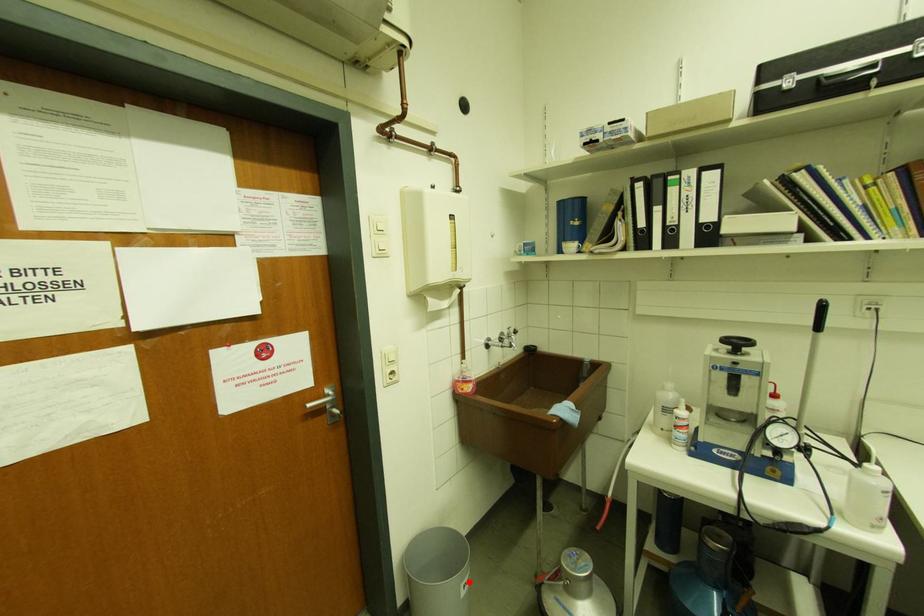
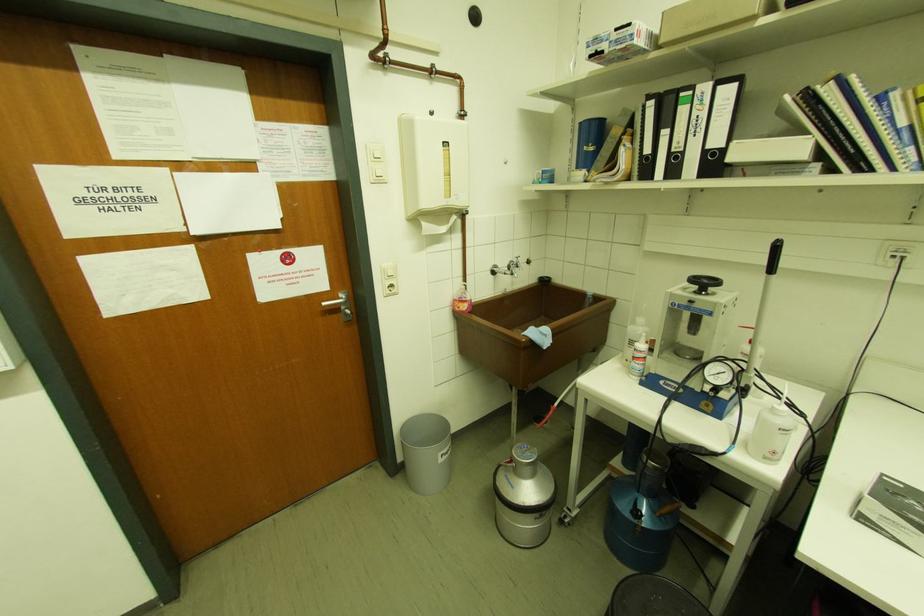
Locate, in the second image, the point that corresponds to the highlighted location in the first image.

(446, 453)